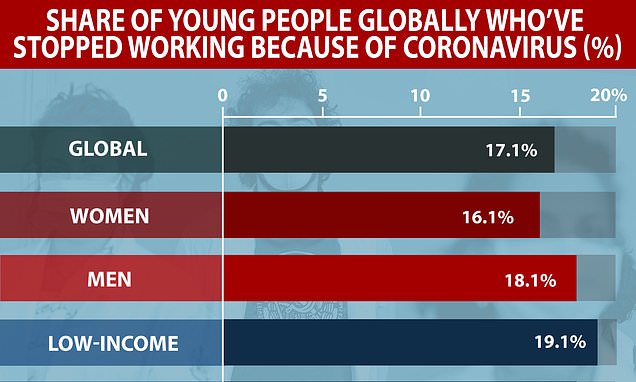
Find the location of a particular element. The image size is (636, 382). dark green bar is located at coordinates (436, 165).